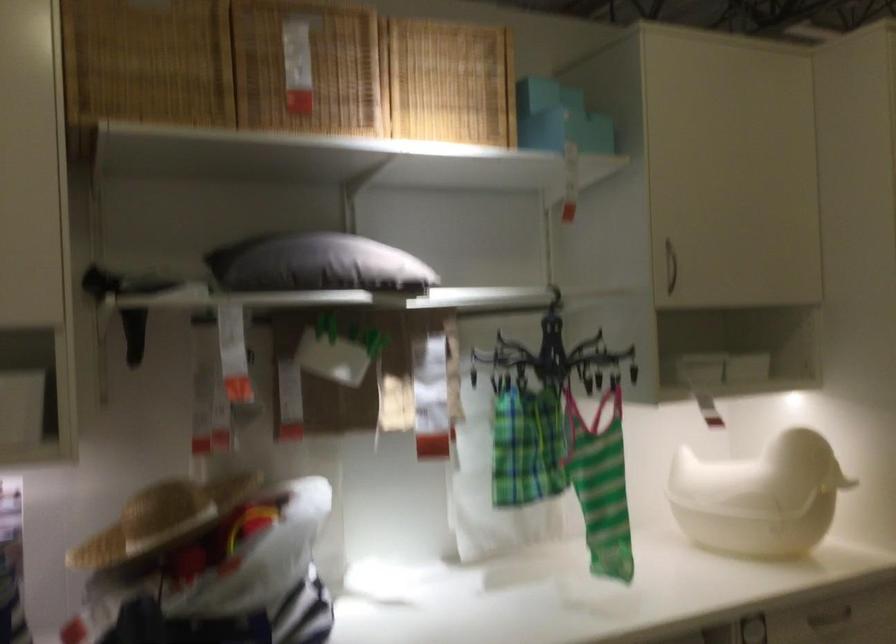
The location [316,263] corresponds to which object?

It corresponds to the dark grey cushion in the image.